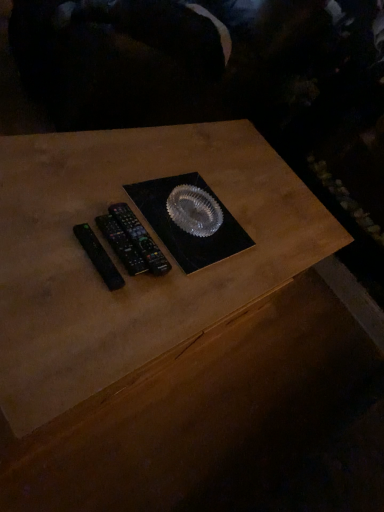
Where is `free region on the left part of black plastic remote at left, placed as the third control when sorted from back to front`? free region on the left part of black plastic remote at left, placed as the third control when sorted from back to front is located at coordinates pyautogui.click(x=48, y=211).